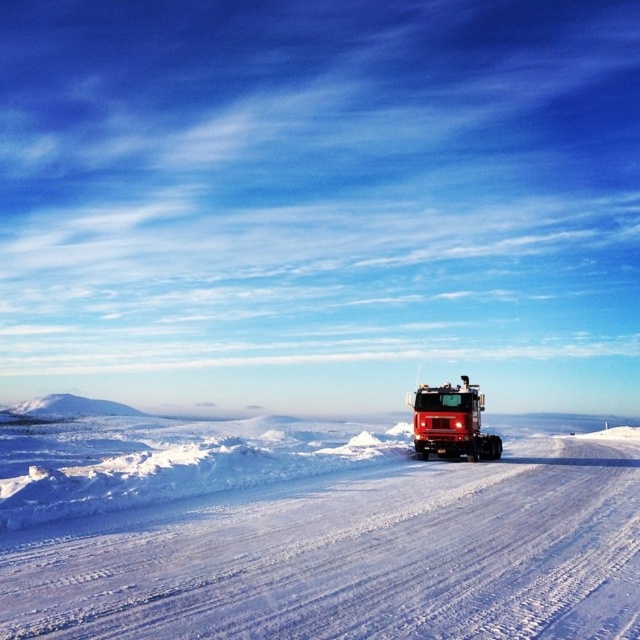
Can you confirm if white powdery snow at center is thinner than red matte fire truck at center?

A: In fact, white powdery snow at center might be wider than red matte fire truck at center.

Does white powdery snow at center come behind red matte fire truck at center?

No, white powdery snow at center is in front of red matte fire truck at center.

Is point (90, 573) closer to viewer compared to point (428, 387)?

Yes, it is.

Where is `white powdery snow at center`? The height and width of the screenshot is (640, 640). white powdery snow at center is located at coordinates (356, 552).